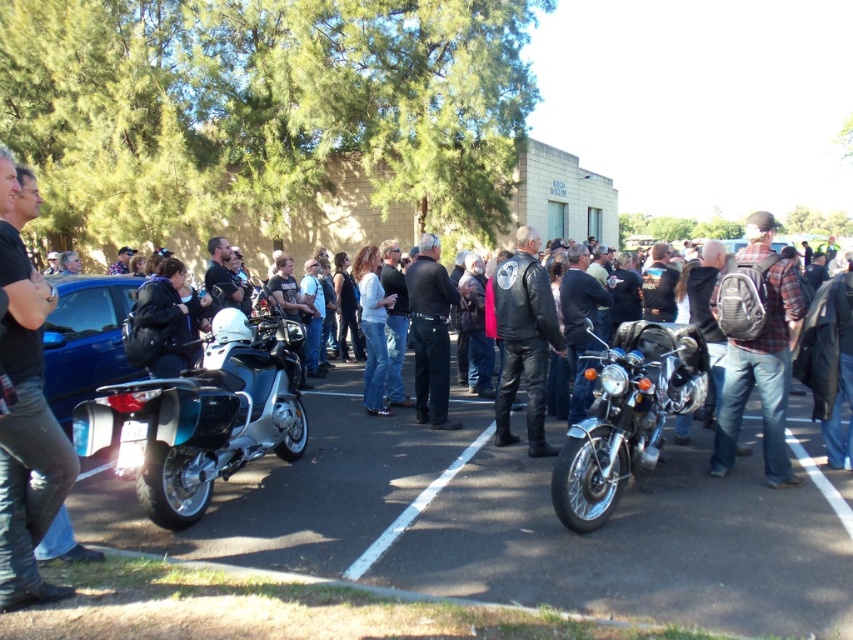
Based on the photo, you are a photographer positioned behind the shiny metallic motorcycle at left and want to take a photo of the black leather jacket at center without the motorcycle blocking it. Is the motorcycle currently blocking your view of the jacket?

The shiny metallic motorcycle at left is in front of the black leather jacket at center, so it is blocking the view. Move to the side to get an unobstructed view.

You are a delivery person who needs to park your 5.5 feet wide delivery van between the shiny chrome motorcycle at center and the white painted line at center. Can you safely park your van there without overlapping either the motorcycle or the line?

The distance between the shiny chrome motorcycle at center and the white painted line at center is 6.01 feet. Since your van is 5.5 feet wide, it can fit within the space as long as it is positioned carefully to avoid overlapping either object.